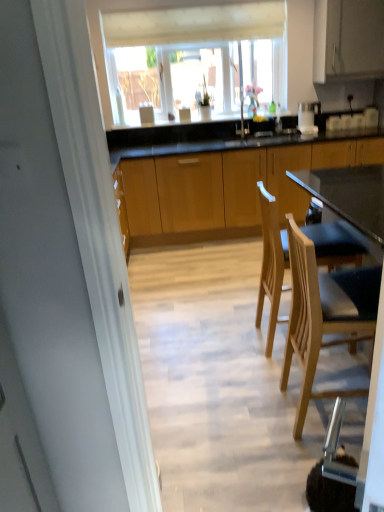
This screenshot has height=512, width=384. I want to click on free space that is to the left of light wood chair at lower right, which is the second chair from back to front, so click(257, 416).